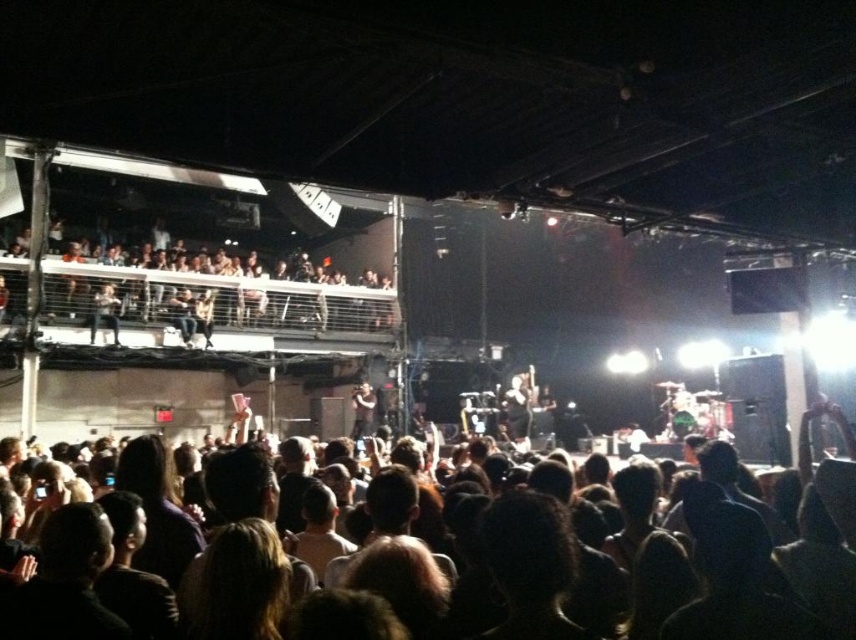
Question: Does dark hair at center have a smaller size compared to matte black jacket at upper left?

Choices:
 (A) no
 (B) yes

Answer: (A)

Question: Is dark hair at center below matte black jacket at upper left?

Choices:
 (A) no
 (B) yes

Answer: (B)

Question: Among these points, which one is nearest to the camera?

Choices:
 (A) (96, 300)
 (B) (562, 564)

Answer: (B)

Question: Which point is closer to the camera taking this photo?

Choices:
 (A) (395, 532)
 (B) (91, 337)

Answer: (A)

Question: Which point is closer to the camera taking this photo?

Choices:
 (A) (96, 298)
 (B) (3, 634)

Answer: (B)

Question: Where is dark hair at center located in relation to matte black jacket at upper left in the image?

Choices:
 (A) right
 (B) left

Answer: (A)